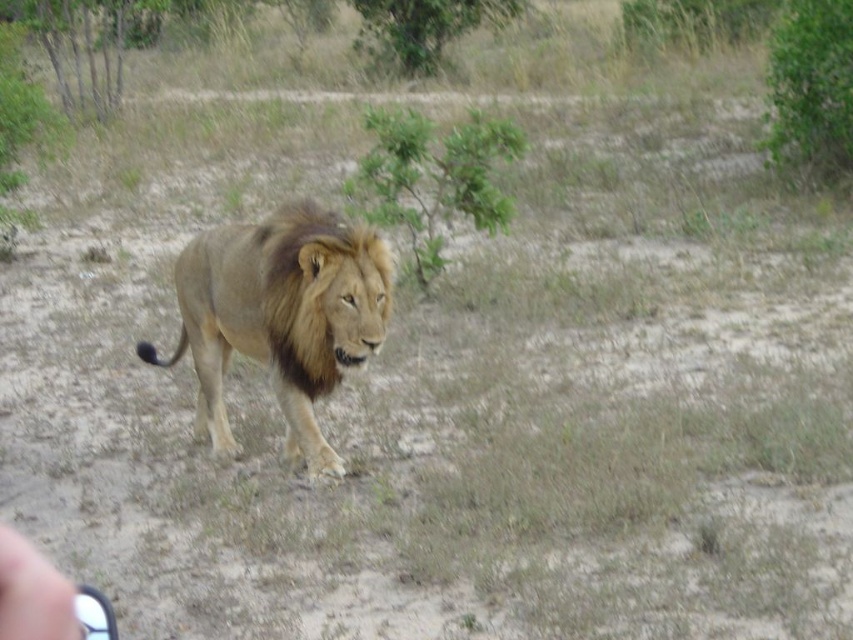
Based on the scene description, which object is taller, the golden brown fur lion at center or the brown fuzzy mane at center?

The golden brown fur lion at center is much taller than the brown fuzzy mane at center.